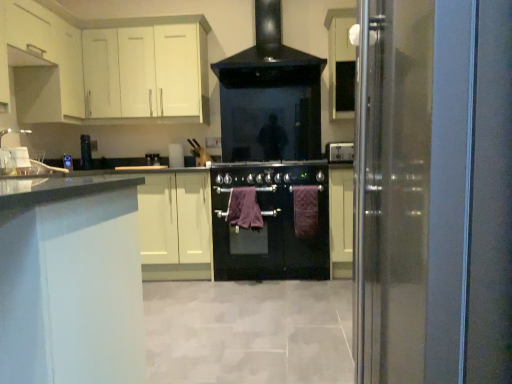
Question: Is purple cotton towel at center, the second blanket positioned from the right, inside the boundaries of transparent glass door at right, or outside?

Choices:
 (A) inside
 (B) outside

Answer: (B)

Question: From a real-world perspective, is purple cotton towel at center, the second blanket positioned from the right, above or below transparent glass door at right?

Choices:
 (A) below
 (B) above

Answer: (A)

Question: Which of these objects is positioned closest to the white matte cabinet at upper left, arranged as the first cabinetry when viewed from the front?

Choices:
 (A) purple cotton towel at center, the second blanket positioned from the right
 (B) transparent glass door at right
 (C) black glass oven at center
 (D) white matte cabinet at upper left, which appears as the second cabinetry when viewed from the front
 (E) purple fabric towel at center, arranged as the second blanket when viewed from the left

Answer: (D)

Question: Which is nearer to the white matte cabinet at upper left, which appears as the second cabinetry when viewed from the front?

Choices:
 (A) satin silver power outlet at upper right, placed as the 2th appliance when sorted from left to right
 (B) white matte cabinet at upper left, which is the second cabinetry in right-to-left order
 (C) purple fabric towel at center, arranged as the second blanket when viewed from the left
 (D) black glossy range hood at upper center
 (E) purple cotton towel at center, which is counted as the first blanket, starting from the left

Answer: (B)